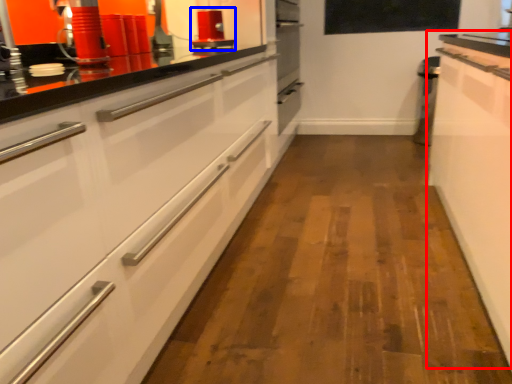
Question: Which of the following is the closest to the observer, cabinetry (highlighted by a red box) or appliance (highlighted by a blue box)?

Choices:
 (A) cabinetry
 (B) appliance

Answer: (A)